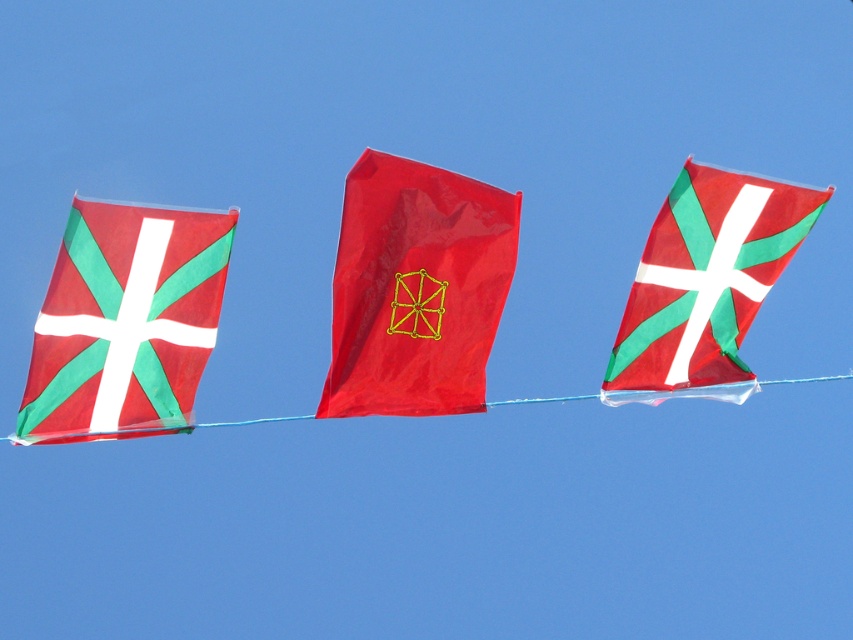
Between shiny red flag at center and matte fabric flag at left, which one appears on the left side from the viewer's perspective?

matte fabric flag at left is more to the left.

Which of these two, shiny red flag at center or matte fabric flag at left, stands shorter?

With less height is shiny red flag at center.

Is point (334, 288) positioned before point (135, 408)?

No, (334, 288) is behind (135, 408).

Where is `shiny red flag at center`? This screenshot has height=640, width=853. shiny red flag at center is located at coordinates (416, 289).

Who is lower down, matte fabric flag at left or matte red flag at center?

matte fabric flag at left is below.

Who is more distant from viewer, [39,349] or [752,220]?

The point [752,220] is more distant.

Between point (146, 221) and point (698, 289), which one is positioned in front?

Positioned in front is point (146, 221).

Where is `matte fabric flag at left`? The height and width of the screenshot is (640, 853). matte fabric flag at left is located at coordinates (125, 323).

Between shiny red flag at center and matte red flag at center, which one appears on the right side from the viewer's perspective?

From the viewer's perspective, matte red flag at center appears more on the right side.

Is shiny red flag at center below matte red flag at center?

No.

In order to click on shiny red flag at center in this screenshot , I will do `click(416, 289)`.